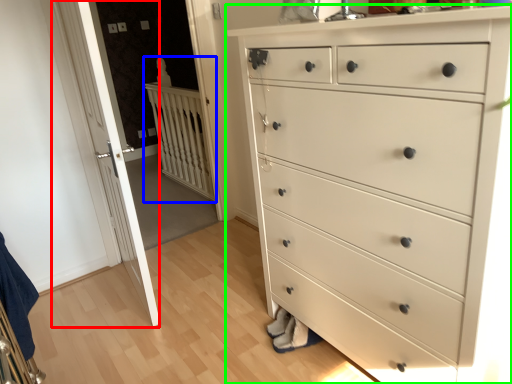
Question: Based on their relative distances, which object is farther from door (highlighted by a red box)? Choose from balustrade (highlighted by a blue box) and chest of drawers (highlighted by a green box).

Choices:
 (A) balustrade
 (B) chest of drawers

Answer: (A)